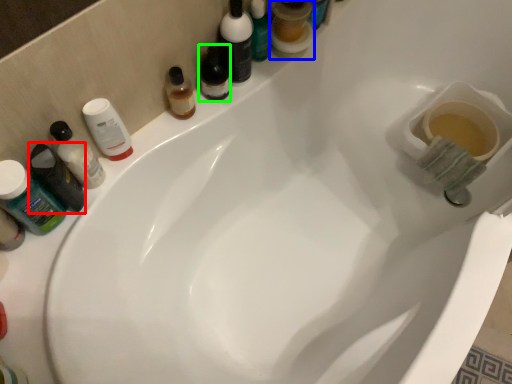
Question: Which object is positioned farthest from toiletry (highlighted by a red box)? Select from mouthwash (highlighted by a blue box) and mouthwash (highlighted by a green box).

Choices:
 (A) mouthwash
 (B) mouthwash

Answer: (A)